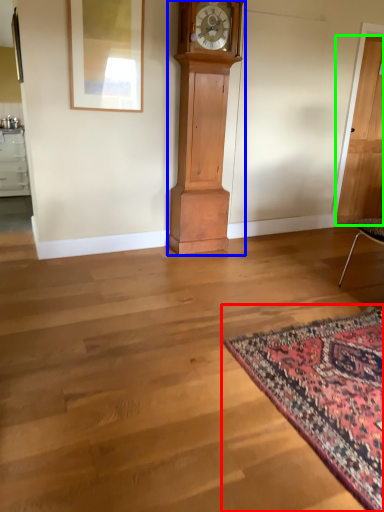
Question: Which object is positioned closest to mat (highlighted by a red box)? Select from furniture (highlighted by a blue box) and door (highlighted by a green box).

Choices:
 (A) furniture
 (B) door

Answer: (A)